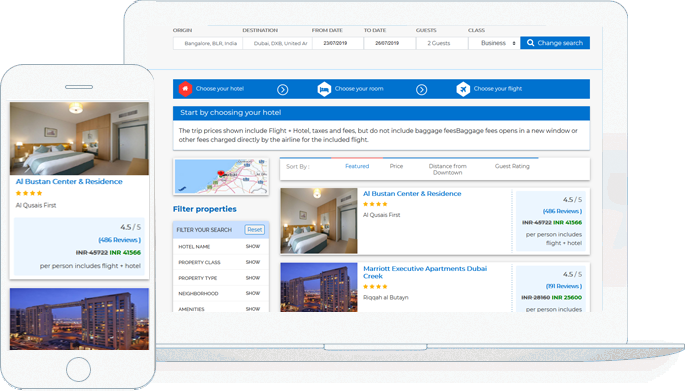
The height and width of the screenshot is (392, 687). I want to click on same images of hotel rooms and hotel building, so click(315, 218), click(312, 285), click(78, 332), click(82, 157).